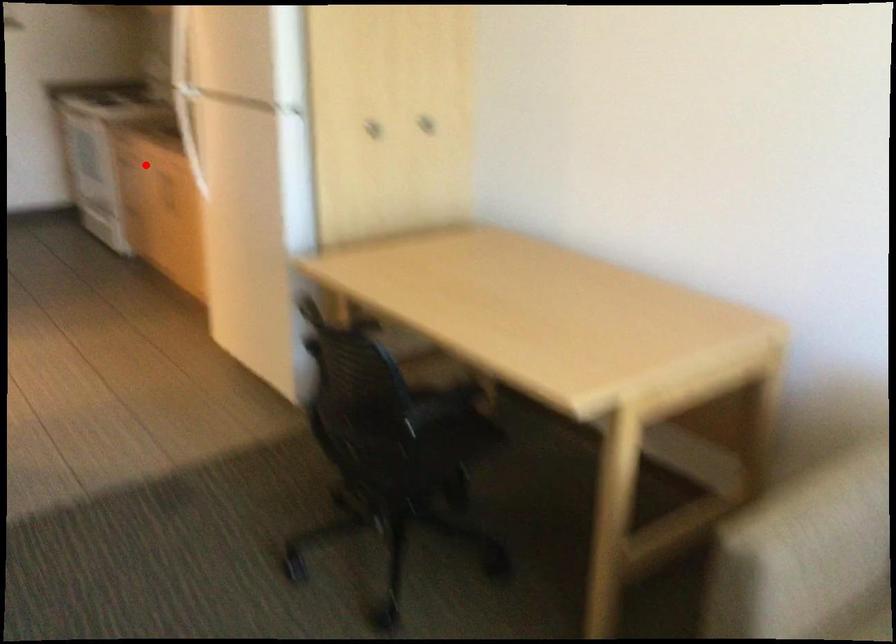
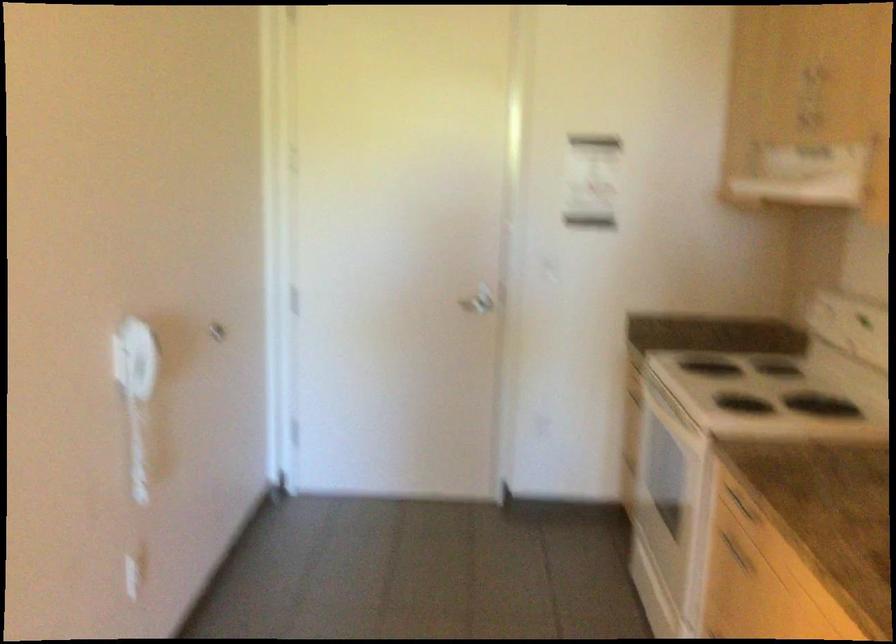
The point at the highlighted location is marked in the first image. Where is the corresponding point in the second image?

(735, 552)